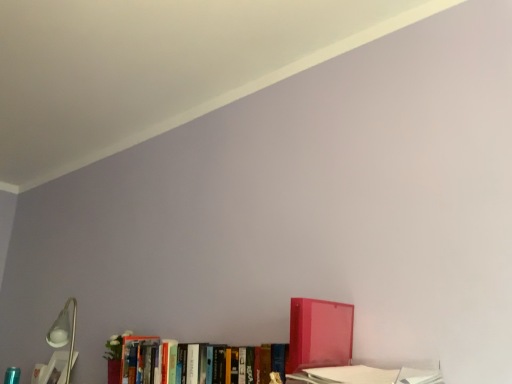
Question: Looking at the image, does hardcover book at lower left, placed as the 1th book when sorted from back to front, seem bigger or smaller compared to hardcover books at center, the second book in the right-to-left sequence?

Choices:
 (A) big
 (B) small

Answer: (B)

Question: Is hardcover book at lower left, which is counted as the 3th book, starting from the right, in front of or behind hardcover books at center, marked as the second book in a left-to-right arrangement, in the image?

Choices:
 (A) front
 (B) behind

Answer: (B)

Question: Considering the real-world distances, which object is closest to the hardcover book at lower left, placed as the 1th book when sorted from back to front?

Choices:
 (A) hardcover books at center, the second book in the right-to-left sequence
 (B) translucent red binder at lower right, which is counted as the 3th book, starting from the left

Answer: (A)

Question: Which object is the closest to the translucent red binder at lower right, arranged as the first book when viewed from the right?

Choices:
 (A) hardcover books at center, marked as the second book in a left-to-right arrangement
 (B) hardcover book at lower left, which is counted as the 3th book, starting from the front

Answer: (A)